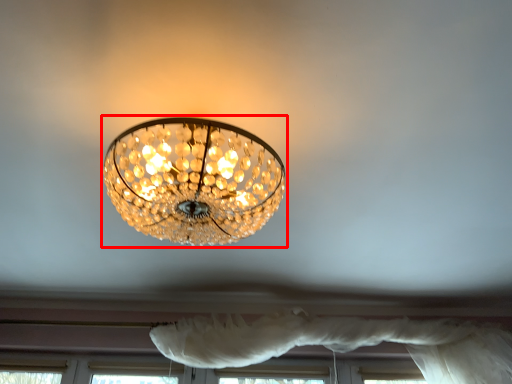
Question: Considering the relative positions of lamp (annotated by the red box) and curtain in the image provided, where is lamp (annotated by the red box) located with respect to the staircase?

Choices:
 (A) left
 (B) right

Answer: (A)